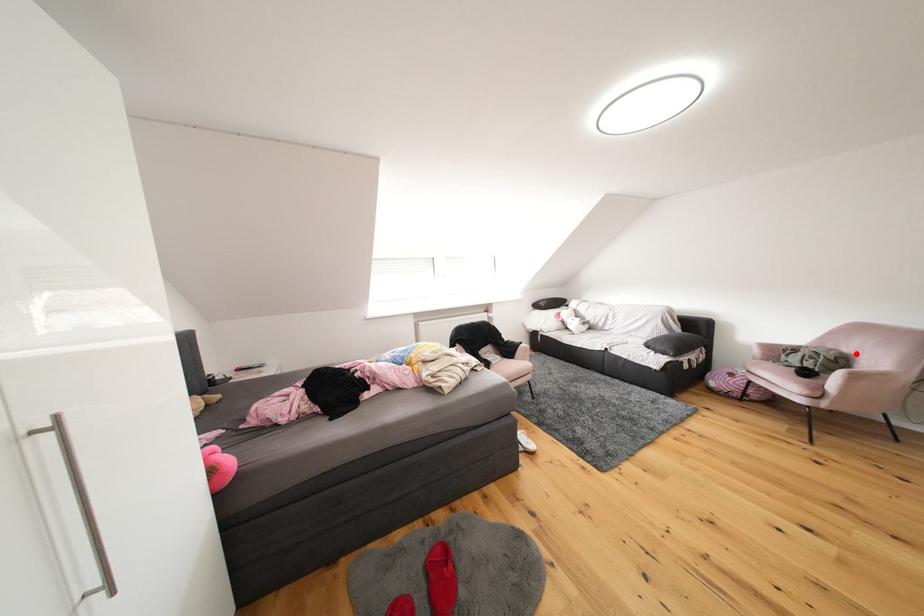
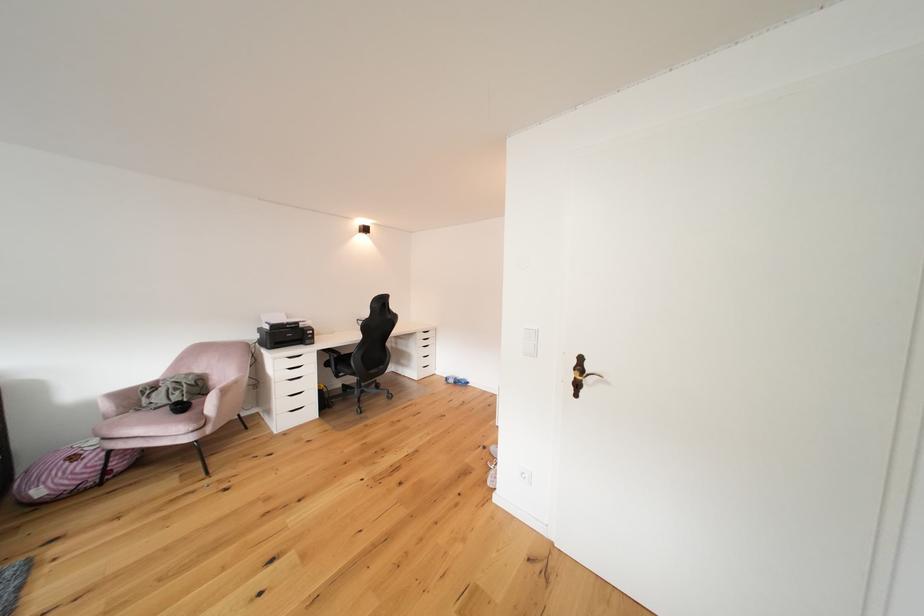
Question: I am providing you with two images of the same scene from different viewpoints. A red point is marked on the first image. At the location where the point appears in image 1, is it still visible in image 2?

Choices:
 (A) Yes
 (B) No

Answer: (A)